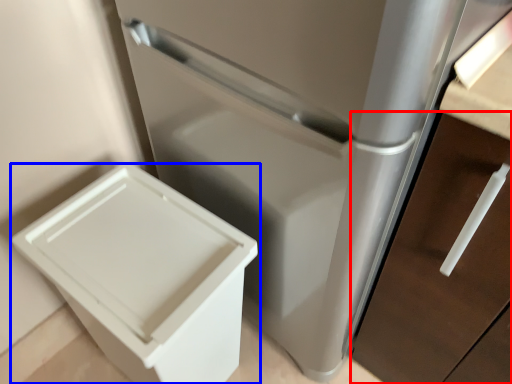
Question: Which point is further to the camera, drawer (highlighted by a red box) or waste container (highlighted by a blue box)?

Choices:
 (A) drawer
 (B) waste container

Answer: (B)